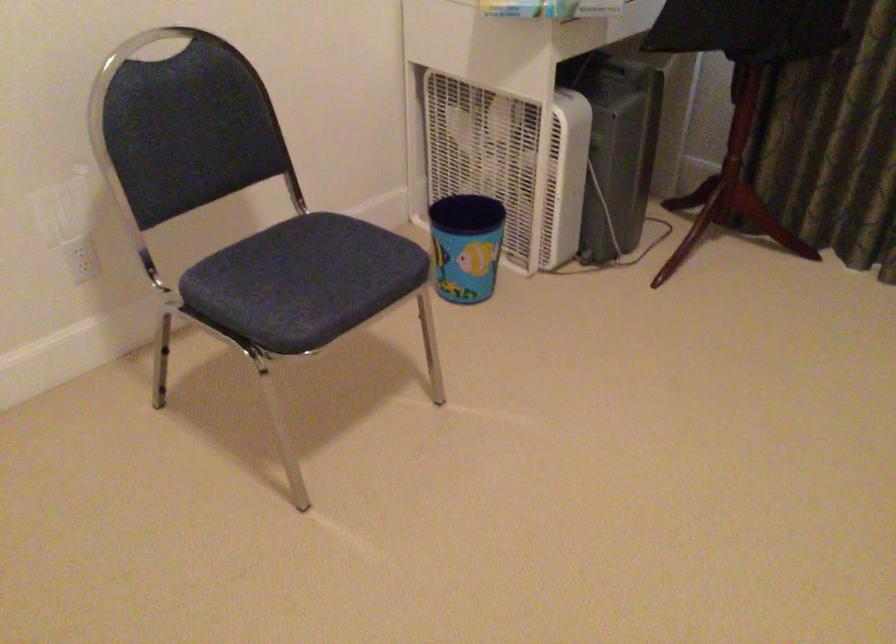
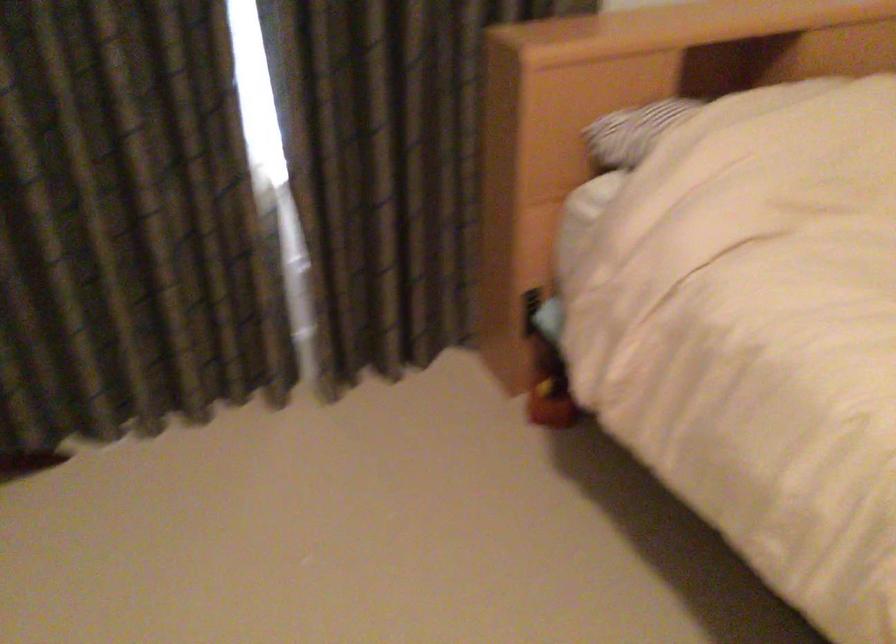
Question: The camera is either moving clockwise (left) or counter-clockwise (right) around the object. The first image is from the beginning of the video and the second image is from the end. Is the camera moving left or right when shooting the video?

Choices:
 (A) Left
 (B) Right

Answer: (A)